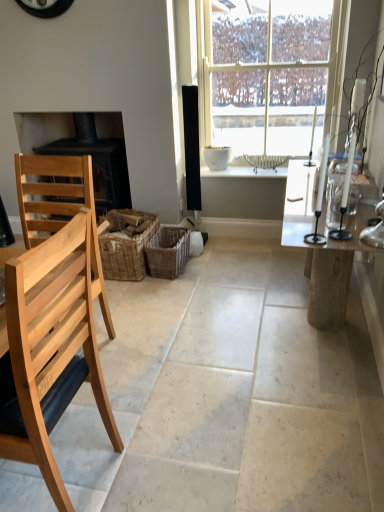
Where is `free point in front of woven brown basket at center, which ranks as the 1th crate in left-to-right order`? The width and height of the screenshot is (384, 512). free point in front of woven brown basket at center, which ranks as the 1th crate in left-to-right order is located at coordinates (140, 294).